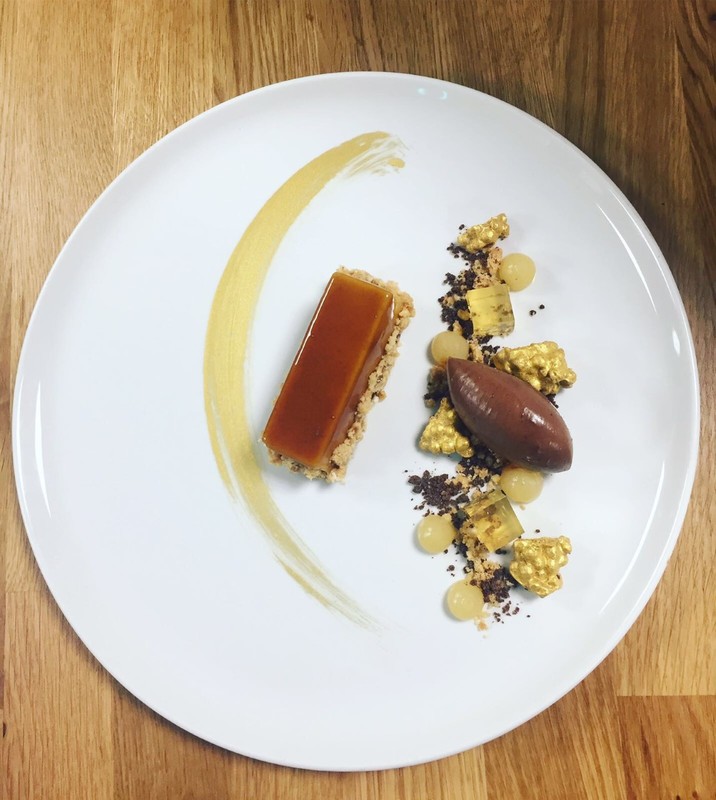
This screenshot has width=716, height=800. Identify the location of plate. (535, 238).